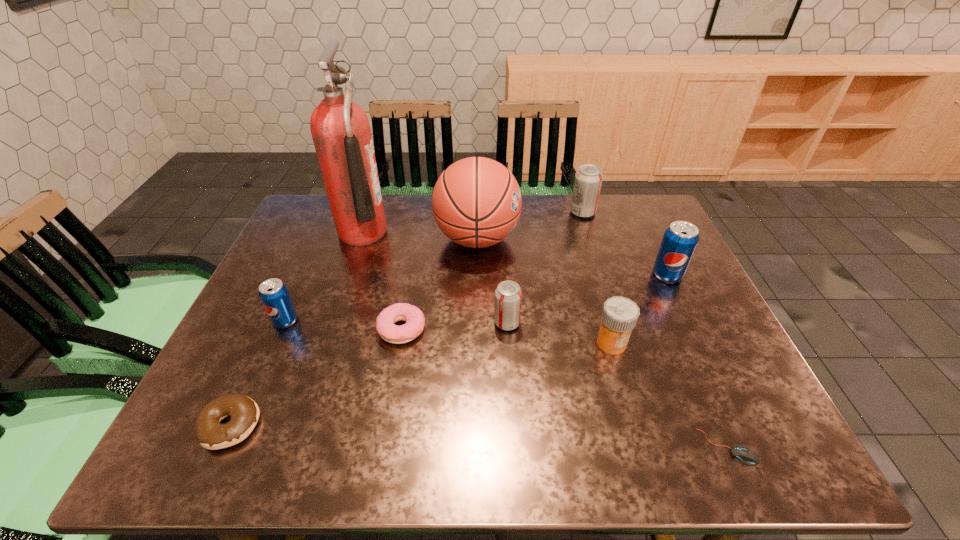
Image resolution: width=960 pixels, height=540 pixels. In order to click on vacant region located on the logo side of the basketball in this screenshot , I will do `click(629, 239)`.

At what (x,y) coordinates should I click in order to perform the action: click on free space located 0.050m on the back of the farthest soda can. Please return your answer as a coordinate pair (x, y). The image size is (960, 540). Looking at the image, I should click on (578, 197).

Identify the location of vacant space located on the back of the rightmost soda can. This screenshot has height=540, width=960. (636, 210).

Find the location of a particular element. The height and width of the screenshot is (540, 960). vacant area situated on the front of the leftmost soda can is located at coordinates (232, 440).

This screenshot has width=960, height=540. I want to click on free point located on the back of the left gray soda can, so click(x=506, y=296).

Where is `free location located on the label side of the orange medicine`? The image size is (960, 540). free location located on the label side of the orange medicine is located at coordinates (621, 377).

You are a GUI agent. You are given a task and a screenshot of the screen. Output one action in this format:
    pyautogui.click(x=<x>, y=<y>)
    Task: Click on the vacant space located 0.080m on the right of the right doughnut
    The image size is (960, 540).
    Given the screenshot: What is the action you would take?
    pyautogui.click(x=459, y=330)

Locate an element on the screen. Image resolution: width=960 pixels, height=540 pixels. blank space located 0.060m on the back of the brown doughnut is located at coordinates (252, 376).

I want to click on vacant space located on the back of the mouse, so click(x=661, y=294).

Identify the location of fire extinguisher that is at the far edge. The width and height of the screenshot is (960, 540). [x=340, y=128].